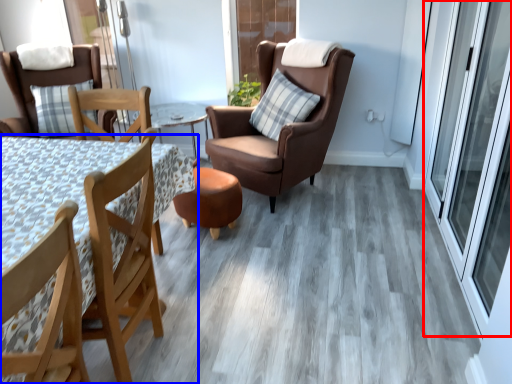
Question: Which of the following is the farthest to the observer, screen door (highlighted by a red box) or table (highlighted by a blue box)?

Choices:
 (A) screen door
 (B) table

Answer: (A)